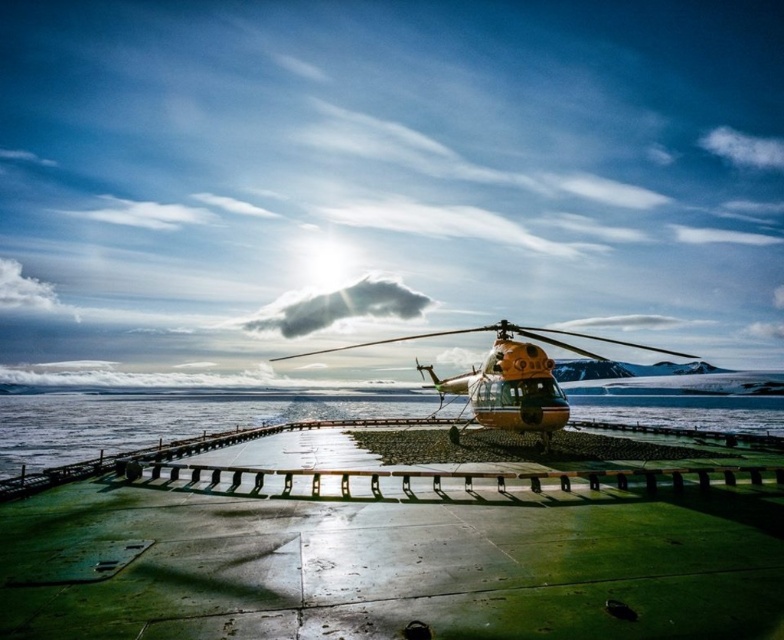
You are a photographer trying to capture the helicopter on the ship deck. You notice two points marked on your screen at coordinates point (144, 547) and point (503, 342). Which point is nearer to your camera lens?

Point (144, 547) is closer to the camera than point (503, 342).

You are a pilot preparing to board the orange matte helicopter at center. From your current position on the green concrete dock at center, which direction should you move to reach the helicopter?

The green concrete dock at center is in front of the orange matte helicopter at center, so you should move backward to reach the helicopter.